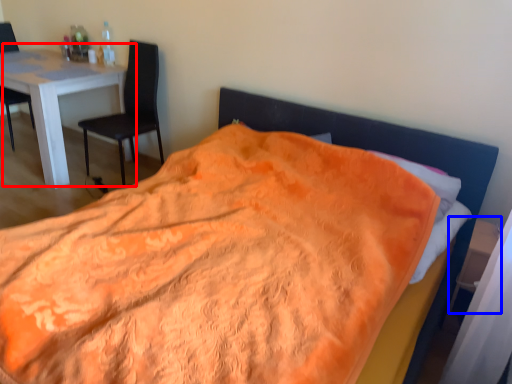
Question: Which object appears closest to the camera in this image, table (highlighted by a red box) or side table (highlighted by a blue box)?

Choices:
 (A) table
 (B) side table

Answer: (B)